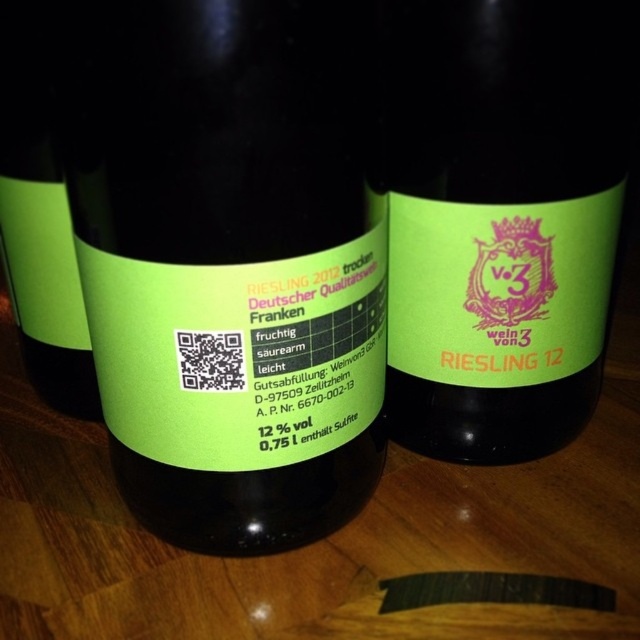
Question: Among these objects, which one is farthest from the camera?

Choices:
 (A) matte green label at center
 (B) green matte bottle at center
 (C) green matte label at center

Answer: (A)

Question: Which object is farther from the camera taking this photo?

Choices:
 (A) green matte bottle at center
 (B) green matte label at center

Answer: (A)

Question: Is green matte label at center further to the viewer compared to green matte bottle at center?

Choices:
 (A) no
 (B) yes

Answer: (A)

Question: Observing the image, what is the correct spatial positioning of green matte label at center in reference to matte green label at center?

Choices:
 (A) above
 (B) below

Answer: (B)

Question: Which point is closer to the camera?

Choices:
 (A) (360, 83)
 (B) (577, 248)

Answer: (A)

Question: Is green matte label at center thinner than matte green label at center?

Choices:
 (A) yes
 (B) no

Answer: (B)